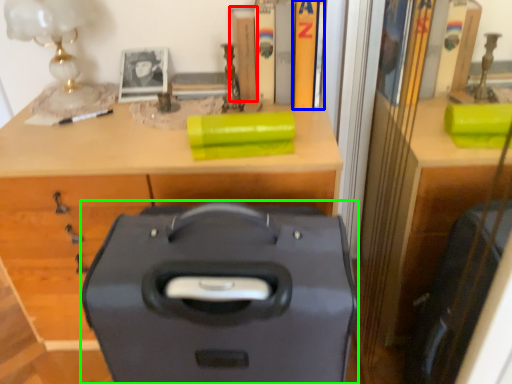
Question: Which is nearer to the book (highlighted by a red box)? book (highlighted by a blue box) or suitcase (highlighted by a green box).

Choices:
 (A) book
 (B) suitcase

Answer: (A)